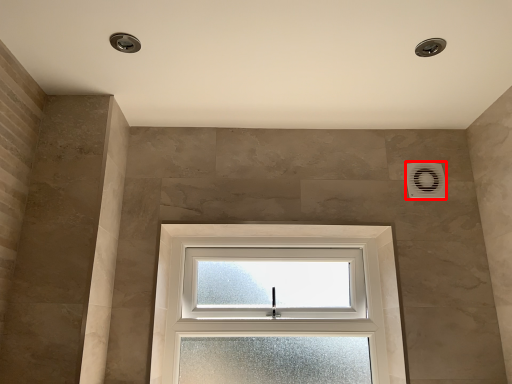
Question: From the image's perspective, where is air conditioning (annotated by the red box) located in relation to window in the image?

Choices:
 (A) below
 (B) above

Answer: (B)